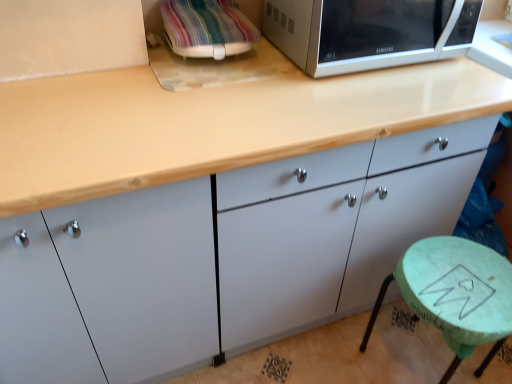
Question: From the image's perspective, is multicolored fabric-covered microwave at upper right on matte white cabinet at center?

Choices:
 (A) yes
 (B) no

Answer: (A)

Question: From a real-world perspective, is multicolored fabric-covered microwave at upper right below matte white cabinet at center?

Choices:
 (A) yes
 (B) no

Answer: (B)

Question: Considering the relative sizes of multicolored fabric-covered microwave at upper right and matte white cabinet at center in the image provided, is multicolored fabric-covered microwave at upper right taller than matte white cabinet at center?

Choices:
 (A) yes
 (B) no

Answer: (B)

Question: Could you tell me if multicolored fabric-covered microwave at upper right is turned towards matte white cabinet at center?

Choices:
 (A) no
 (B) yes

Answer: (A)

Question: Can you confirm if multicolored fabric-covered microwave at upper right is wider than matte white cabinet at center?

Choices:
 (A) no
 (B) yes

Answer: (A)

Question: Is multicolored fabric-covered microwave at upper right inside the boundaries of matte white cabinet at center, or outside?

Choices:
 (A) inside
 (B) outside

Answer: (B)

Question: Visually, is multicolored fabric-covered microwave at upper right positioned to the left or to the right of matte white cabinet at center?

Choices:
 (A) right
 (B) left

Answer: (B)

Question: Is point (205, 29) closer or farther from the camera than point (166, 200)?

Choices:
 (A) closer
 (B) farther

Answer: (B)

Question: In the image, is multicolored fabric-covered microwave at upper right positioned in front of or behind matte white cabinet at center?

Choices:
 (A) behind
 (B) front

Answer: (A)

Question: Considering the positions of green marble stool at lower right and satin silver microwave at upper right in the image, is green marble stool at lower right bigger or smaller than satin silver microwave at upper right?

Choices:
 (A) big
 (B) small

Answer: (A)

Question: From a real-world perspective, is green marble stool at lower right above or below satin silver microwave at upper right?

Choices:
 (A) below
 (B) above

Answer: (A)

Question: Considering the positions of green marble stool at lower right and satin silver microwave at upper right in the image, is green marble stool at lower right wider or thinner than satin silver microwave at upper right?

Choices:
 (A) wide
 (B) thin

Answer: (B)

Question: Is point (500, 311) positioned closer to the camera than point (310, 44)?

Choices:
 (A) closer
 (B) farther

Answer: (B)

Question: Is satin silver microwave at upper right wider or thinner than green marble stool at lower right?

Choices:
 (A) thin
 (B) wide

Answer: (B)

Question: Relative to green marble stool at lower right, is satin silver microwave at upper right in front or behind?

Choices:
 (A) behind
 (B) front

Answer: (B)